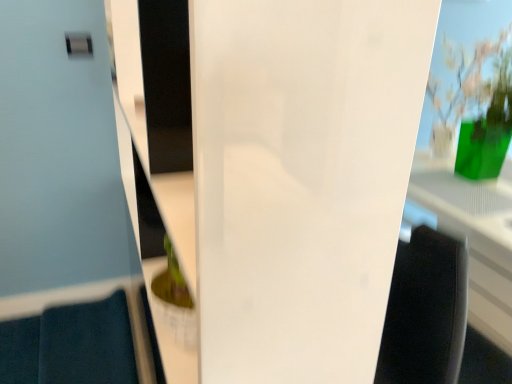
Question: Do you think green glass vase at upper right is within transparent glass door at center, or outside of it?

Choices:
 (A) inside
 (B) outside

Answer: (B)

Question: Looking at their shapes, would you say green glass vase at upper right is wider or thinner than transparent glass door at center?

Choices:
 (A) wide
 (B) thin

Answer: (A)

Question: Looking at the image, does green glass vase at upper right seem bigger or smaller compared to transparent glass door at center?

Choices:
 (A) small
 (B) big

Answer: (A)

Question: Looking at their shapes, would you say transparent glass door at center is wider or thinner than green glass vase at upper right?

Choices:
 (A) wide
 (B) thin

Answer: (B)

Question: From the image's perspective, is transparent glass door at center above or below green glass vase at upper right?

Choices:
 (A) below
 (B) above

Answer: (A)

Question: Would you say transparent glass door at center is to the left or to the right of green glass vase at upper right in the picture?

Choices:
 (A) right
 (B) left

Answer: (B)

Question: Based on their sizes in the image, would you say transparent glass door at center is bigger or smaller than green glass vase at upper right?

Choices:
 (A) small
 (B) big

Answer: (B)